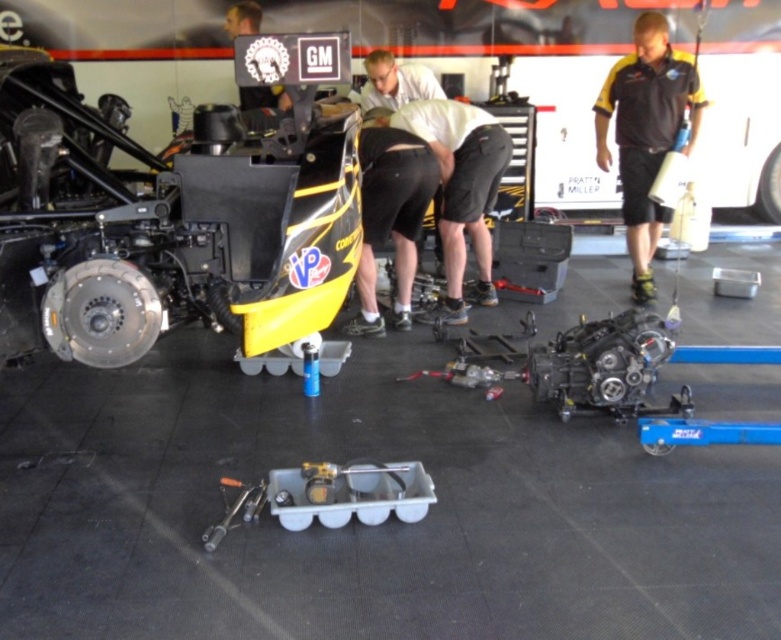
Which is behind, point (626, 134) or point (377, 106)?

Positioned behind is point (377, 106).

Does black/yellow shirt at right appear on the right side of white matte shirt at center?

Correct, you'll find black/yellow shirt at right to the right of white matte shirt at center.

I want to click on black/yellow shirt at right, so click(x=646, y=132).

Who is more distant from viewer, (27, 195) or (419, 193)?

Point (419, 193)

Is point (314, 124) in front of point (394, 198)?

Yes, it is.

This screenshot has width=781, height=640. I want to click on shiny metallic engine at center, so click(175, 216).

Does point (651, 92) lie in front of point (369, 186)?

No.

Identify the location of black/yellow shirt at right. The image size is (781, 640). (646, 132).

Locate an element on the screen. The width and height of the screenshot is (781, 640). black/yellow shirt at right is located at coordinates (646, 132).